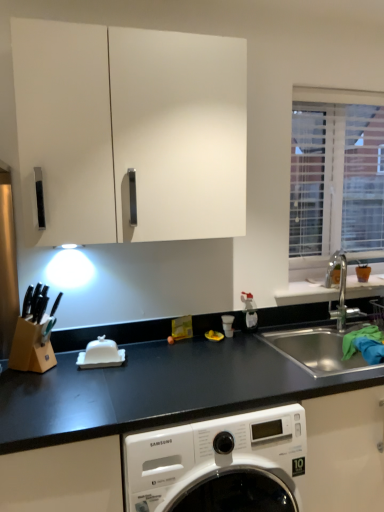
This screenshot has height=512, width=384. What do you see at coordinates (325, 328) in the screenshot?
I see `stainless steel sink at right` at bounding box center [325, 328].

The height and width of the screenshot is (512, 384). In order to click on white matte window sill at right in this screenshot , I will do `click(306, 293)`.

Which of these two, white glossy cabinet at upper center or white glossy butter dish at center, is smaller?

Smaller between the two is white glossy butter dish at center.

From a real-world perspective, is white glossy cabinet at upper center above or below white glossy butter dish at center?

Clearly, from a real-world perspective, white glossy cabinet at upper center is above white glossy butter dish at center.

Considering the relative positions of white glossy cabinet at upper center and white glossy butter dish at center in the image provided, is white glossy cabinet at upper center to the left or to the right of white glossy butter dish at center?

In the image, white glossy cabinet at upper center appears on the right side of white glossy butter dish at center.

Considering the sizes of objects black matte countertop at lower center and white blinds at upper right in the image provided, who is thinner, black matte countertop at lower center or white blinds at upper right?

With smaller width is white blinds at upper right.

Is black matte countertop at lower center behind white blinds at upper right?

No, black matte countertop at lower center is in front of white blinds at upper right.

Are black matte countertop at lower center and white blinds at upper right located far from each other?

Yes, black matte countertop at lower center is far from white blinds at upper right.

Between white glossy cabinet at upper center and stainless steel sink at right, which one has larger size?

Bigger between the two is stainless steel sink at right.

Is white glossy cabinet at upper center taller than stainless steel sink at right?

Yes, white glossy cabinet at upper center is taller than stainless steel sink at right.

Considering the points (192, 35) and (320, 302), which point is in front, point (192, 35) or point (320, 302)?

The point (192, 35) is more forward.

From the image's perspective, between white glossy butter dish at center and white blinds at upper right, which one is located above?

white blinds at upper right is shown above in the image.

Considering the positions of objects white glossy butter dish at center and white blinds at upper right in the image provided, who is more to the left, white glossy butter dish at center or white blinds at upper right?

From the viewer's perspective, white glossy butter dish at center appears more on the left side.

Between white glossy butter dish at center and white blinds at upper right, which one has larger size?

With larger size is white blinds at upper right.

From a real-world perspective, is white glossy butter dish at center above or below white blinds at upper right?

In terms of real-world spatial position, white glossy butter dish at center is below white blinds at upper right.

Would you say white glossy cabinet at upper center is inside or outside white blinds at upper right?

white glossy cabinet at upper center cannot be found inside white blinds at upper right.

Does white glossy cabinet at upper center lie in front of white blinds at upper right?

Yes, white glossy cabinet at upper center is closer to the viewer.

Based on their sizes in the image, would you say white glossy cabinet at upper center is bigger or smaller than white blinds at upper right?

white glossy cabinet at upper center is bigger than white blinds at upper right.

From a real-world perspective, which is physically below, white glossy cabinet at upper center or white blinds at upper right?

From a 3D spatial view, white blinds at upper right is below.

Is black matte countertop at lower center in front of white glossy cabinet at upper center?

Yes, black matte countertop at lower center is in front of white glossy cabinet at upper center.

From a real-world perspective, is black matte countertop at lower center physically above white glossy cabinet at upper center?

No, from a real-world perspective, black matte countertop at lower center is not over white glossy cabinet at upper center

From the image's perspective, is black matte countertop at lower center above or below white glossy cabinet at upper center?

black matte countertop at lower center is situated lower than white glossy cabinet at upper center in the image.

Considering the sizes of black matte countertop at lower center and white glossy cabinet at upper center in the image, is black matte countertop at lower center wider or thinner than white glossy cabinet at upper center?

Clearly, black matte countertop at lower center has more width compared to white glossy cabinet at upper center.

How many degrees apart are the facing directions of white glossy cabinet at upper center and black matte countertop at lower center?

0.235 degrees separate the facing orientations of white glossy cabinet at upper center and black matte countertop at lower center.

Can you confirm if white glossy cabinet at upper center is wider than black matte countertop at lower center?

No, white glossy cabinet at upper center is not wider than black matte countertop at lower center.

In the scene shown: Considering the positions of objects white glossy cabinet at upper center and black matte countertop at lower center in the image provided, who is behind, white glossy cabinet at upper center or black matte countertop at lower center?

white glossy cabinet at upper center is further away from the camera.

Considering the relative positions of white glossy cabinet at upper center and black matte countertop at lower center in the image provided, is white glossy cabinet at upper center to the left or to the right of black matte countertop at lower center?

In the image, white glossy cabinet at upper center appears on the left side of black matte countertop at lower center.

I want to click on appliance below the white glossy cabinet at upper center (from the image's perspective), so click(101, 354).

You are a GUI agent. You are given a task and a screenshot of the screen. Output one action in this format:
    pyautogui.click(x=<x>, y=<y>)
    Task: Click on the countertop below the white blinds at upper right (from a real-world perspective)
    
    Given the screenshot: What is the action you would take?
    pyautogui.click(x=175, y=420)

Considering their positions, is white matte window sill at right positioned closer to white glossy butter dish at center than white glossy cabinet at upper center?

The object closer to white glossy butter dish at center is white glossy cabinet at upper center.

From the image, which object appears to be farther from white blinds at upper right, white glossy cabinet at upper center or white glossy butter dish at center?

white glossy butter dish at center is positioned further to the anchor white blinds at upper right.

Considering their positions, is white glossy cabinet at upper center positioned closer to black matte countertop at lower center than white blinds at upper right?

The object closer to black matte countertop at lower center is white glossy cabinet at upper center.

Considering their positions, is white blinds at upper right positioned further to stainless steel sink at right than white glossy butter dish at center?

white glossy butter dish at center is positioned further to the anchor stainless steel sink at right.

From the image, which object appears to be farther from black matte countertop at lower center, white blinds at upper right or stainless steel sink at right?

white blinds at upper right.

Considering their positions, is white matte window sill at right positioned closer to stainless steel sink at right than white glossy cabinet at upper center?

white matte window sill at right is closer to stainless steel sink at right.

Which object lies nearer to the anchor point black matte countertop at lower center, white blinds at upper right or white matte window sill at right?

Among the two, white matte window sill at right is located nearer to black matte countertop at lower center.

Based on their spatial positions, is black matte countertop at lower center or stainless steel sink at right further from white matte window sill at right?

black matte countertop at lower center is further to white matte window sill at right.

This screenshot has height=512, width=384. Find the location of `countertop between white glossy butter dish at center and white matte window sill at right in the horizontal direction`. countertop between white glossy butter dish at center and white matte window sill at right in the horizontal direction is located at coordinates (175, 420).

You are a GUI agent. You are given a task and a screenshot of the screen. Output one action in this format:
    pyautogui.click(x=<x>, y=<y>)
    Task: Click on the window sill between white blinds at upper right and stainless steel sink at right in the up-down direction
    The width and height of the screenshot is (384, 512).
    Given the screenshot: What is the action you would take?
    pyautogui.click(x=306, y=293)

Identify the location of sink between white glossy butter dish at center and white matte window sill at right in the horizontal direction. (325, 328).

I want to click on sink between white glossy butter dish at center and white blinds at upper right, so click(325, 328).